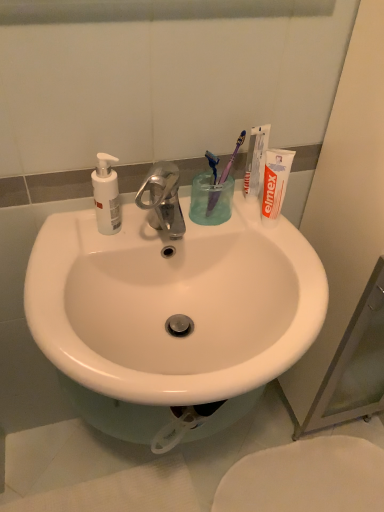
Where is `vacant area that is situated to the right of purple plastic toothbrush at upper center, which appears as the first toothbrush when viewed from the left`? The height and width of the screenshot is (512, 384). vacant area that is situated to the right of purple plastic toothbrush at upper center, which appears as the first toothbrush when viewed from the left is located at coordinates (261, 226).